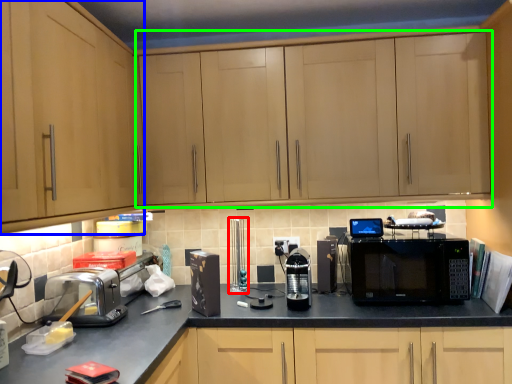
Question: Based on their relative distances, which object is farther from appliance (highlighted by a red box)? Choose from cabinetry (highlighted by a blue box) and cabinetry (highlighted by a green box).

Choices:
 (A) cabinetry
 (B) cabinetry

Answer: (A)